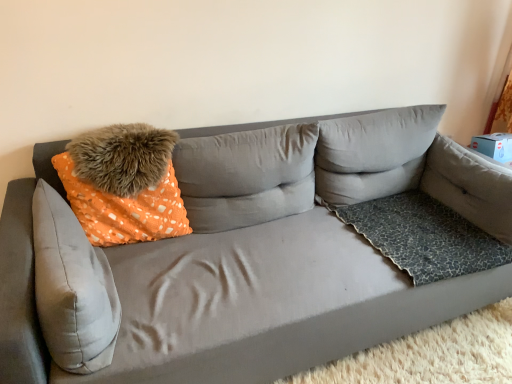
Question: Would you say gray fabric pillow at upper right, the 4th pillow when ordered from left to right, is part of leopard print fabric pillow at right, the 1th pillow from the right,'s contents?

Choices:
 (A) no
 (B) yes

Answer: (A)

Question: From the image's perspective, would you say leopard print fabric pillow at right, the 1th pillow from the right, is positioned over gray fabric pillow at upper right, the 2th pillow in the right-to-left sequence?

Choices:
 (A) yes
 (B) no

Answer: (B)

Question: Can we say leopard print fabric pillow at right, the 1th pillow from the right, lies outside gray fabric pillow at upper right, the 4th pillow when ordered from left to right?

Choices:
 (A) yes
 (B) no

Answer: (A)

Question: Is leopard print fabric pillow at right, the 1th pillow from the right, to the left of gray fabric pillow at upper right, the 4th pillow when ordered from left to right, from the viewer's perspective?

Choices:
 (A) yes
 (B) no

Answer: (B)

Question: Is leopard print fabric pillow at right, the 5th pillow in the left-to-right sequence, thinner than gray fabric pillow at upper right, the 2th pillow in the right-to-left sequence?

Choices:
 (A) yes
 (B) no

Answer: (B)

Question: In terms of size, does gray fabric pillow at upper right, the 2th pillow in the right-to-left sequence, appear bigger or smaller than leopard print fabric dog bed at right?

Choices:
 (A) big
 (B) small

Answer: (A)

Question: From a real-world perspective, is gray fabric pillow at upper right, the 2th pillow in the right-to-left sequence, above or below leopard print fabric dog bed at right?

Choices:
 (A) above
 (B) below

Answer: (A)

Question: In the image, is gray fabric pillow at upper right, the 2th pillow in the right-to-left sequence, positioned in front of or behind leopard print fabric dog bed at right?

Choices:
 (A) behind
 (B) front

Answer: (A)

Question: Considering the positions of gray fabric pillow at upper right, the 4th pillow when ordered from left to right, and leopard print fabric dog bed at right in the image, is gray fabric pillow at upper right, the 4th pillow when ordered from left to right, wider or thinner than leopard print fabric dog bed at right?

Choices:
 (A) wide
 (B) thin

Answer: (B)

Question: Is leopard print fabric pillow at right, the 1th pillow from the right, situated inside suede gray couch at center or outside?

Choices:
 (A) outside
 (B) inside

Answer: (B)

Question: Is leopard print fabric pillow at right, the 1th pillow from the right, taller or shorter than suede gray couch at center?

Choices:
 (A) short
 (B) tall

Answer: (A)

Question: From the image's perspective, is leopard print fabric pillow at right, the 1th pillow from the right, above or below suede gray couch at center?

Choices:
 (A) above
 (B) below

Answer: (A)

Question: In terms of size, does leopard print fabric pillow at right, the 5th pillow in the left-to-right sequence, appear bigger or smaller than suede gray couch at center?

Choices:
 (A) big
 (B) small

Answer: (B)

Question: From the image's perspective, relative to orange dotted fabric pillow at upper center, the 3th pillow positioned from the right, is leopard print fabric pillow at right, the 1th pillow from the right, above or below?

Choices:
 (A) below
 (B) above

Answer: (A)

Question: Is point (476, 175) closer or farther from the camera than point (236, 145)?

Choices:
 (A) farther
 (B) closer

Answer: (A)